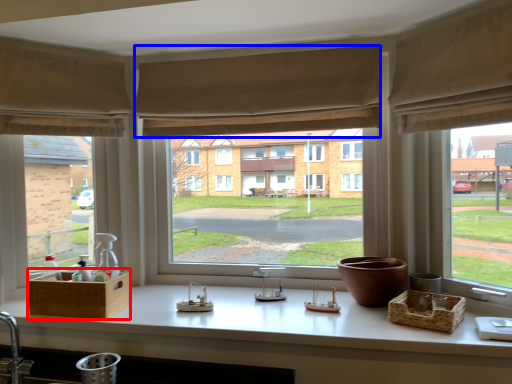
Question: Which object appears closest to the camera in this image, basket (highlighted by a red box) or curtain (highlighted by a blue box)?

Choices:
 (A) basket
 (B) curtain

Answer: (A)